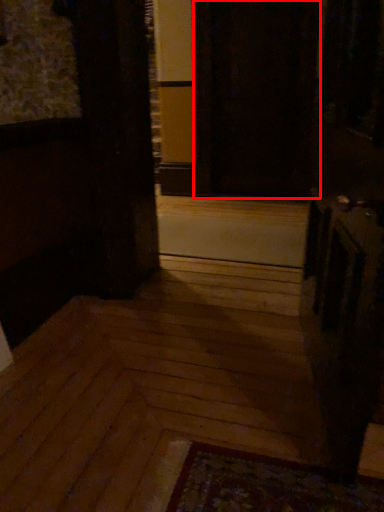
Question: From the image's perspective, what is the correct spatial positioning of screen door (annotated by the red box) in reference to stairwell?

Choices:
 (A) above
 (B) below

Answer: (A)